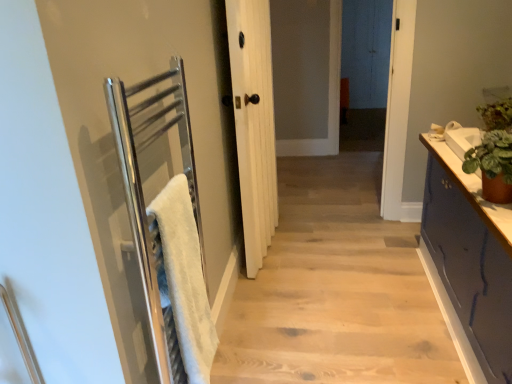
Question: Would you say green matte plant pot at right is a long distance from green leafy plant at right?

Choices:
 (A) yes
 (B) no

Answer: (B)

Question: Is green matte plant pot at right shorter than green leafy plant at right?

Choices:
 (A) no
 (B) yes

Answer: (A)

Question: Considering the relative sizes of green matte plant pot at right and green leafy plant at right in the image provided, is green matte plant pot at right wider than green leafy plant at right?

Choices:
 (A) no
 (B) yes

Answer: (B)

Question: Are green matte plant pot at right and green leafy plant at right beside each other?

Choices:
 (A) yes
 (B) no

Answer: (B)

Question: Is green matte plant pot at right positioned with its back to green leafy plant at right?

Choices:
 (A) no
 (B) yes

Answer: (A)

Question: Based on their positions, is dark blue painted cabinet at right located to the left or right of white fluffy bath towel at left?

Choices:
 (A) left
 (B) right

Answer: (B)

Question: Is point (432, 165) positioned closer to the camera than point (169, 268)?

Choices:
 (A) closer
 (B) farther

Answer: (B)

Question: In the image, is dark blue painted cabinet at right positioned in front of or behind white fluffy bath towel at left?

Choices:
 (A) behind
 (B) front

Answer: (B)

Question: Do you think dark blue painted cabinet at right is within white fluffy bath towel at left, or outside of it?

Choices:
 (A) inside
 (B) outside

Answer: (B)

Question: From a real-world perspective, is white wood door at center positioned above or below brushed metal towel rail at left?

Choices:
 (A) above
 (B) below

Answer: (A)

Question: Is white wood door at center in front of or behind brushed metal towel rail at left in the image?

Choices:
 (A) behind
 (B) front

Answer: (A)

Question: From their relative heights in the image, would you say white wood door at center is taller or shorter than brushed metal towel rail at left?

Choices:
 (A) short
 (B) tall

Answer: (B)

Question: Is white wood door at center situated inside brushed metal towel rail at left or outside?

Choices:
 (A) outside
 (B) inside

Answer: (A)

Question: Relative to green leafy plant at right, is brushed metal towel rail at left in front or behind?

Choices:
 (A) behind
 (B) front

Answer: (B)

Question: In the image, is brushed metal towel rail at left on the left side or the right side of green leafy plant at right?

Choices:
 (A) right
 (B) left

Answer: (B)